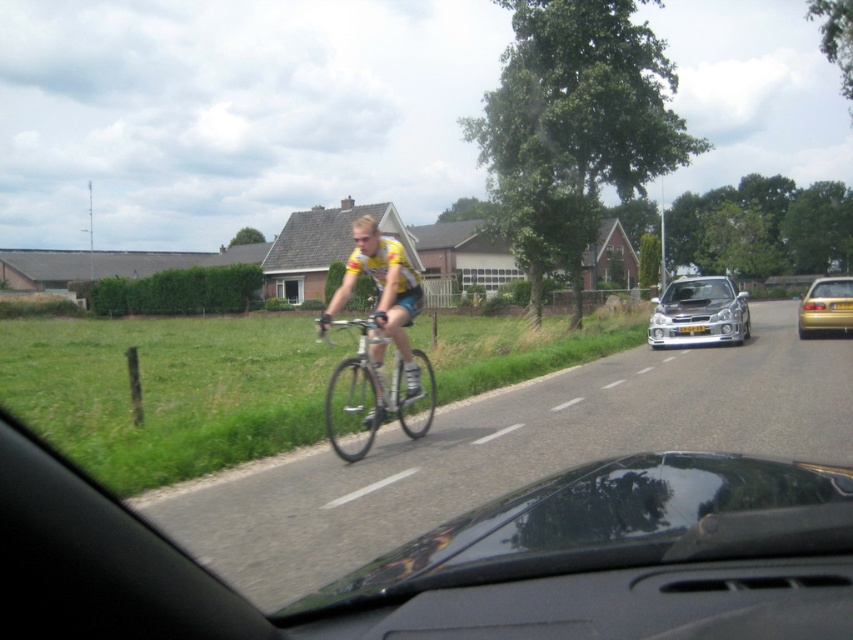
You are a passenger in the car and want to describe the position of the silver metallic bicycle at center to the driver who is about to make a turn. Where exactly is the bicycle located in relation to the car?

The silver metallic bicycle at center is located at the center of the image, which corresponds to the road directly in front of the car. Since the driver is in the driver seat, the bicycle is straight ahead in the middle of the road.